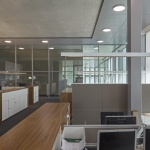
I want to click on clear glass, so click(44, 59).